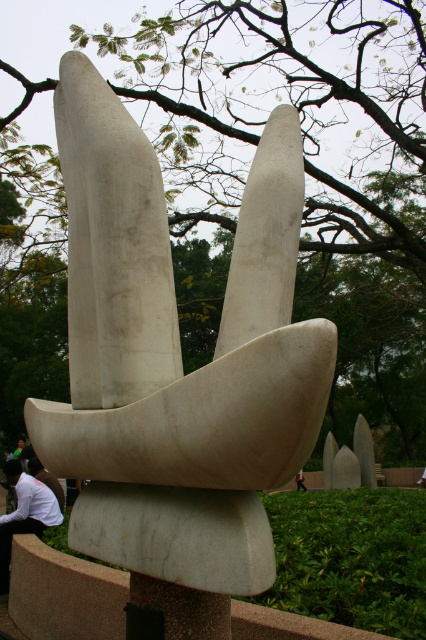
You are standing at the entrance of the park and want to locate the white marble sculpture at center. According to the map, your current position is at point 0.559, 0.415. Can you determine if you are already at the sculpture?

The white marble sculpture at center is located at point (176, 356), so yes, you are already at the sculpture.

You are standing in a park and see the white marble sculpture at center and the white shirt at lower left. Which object is closer to you?

The white marble sculpture at center is closer to you because it is in front of the white shirt at lower left.